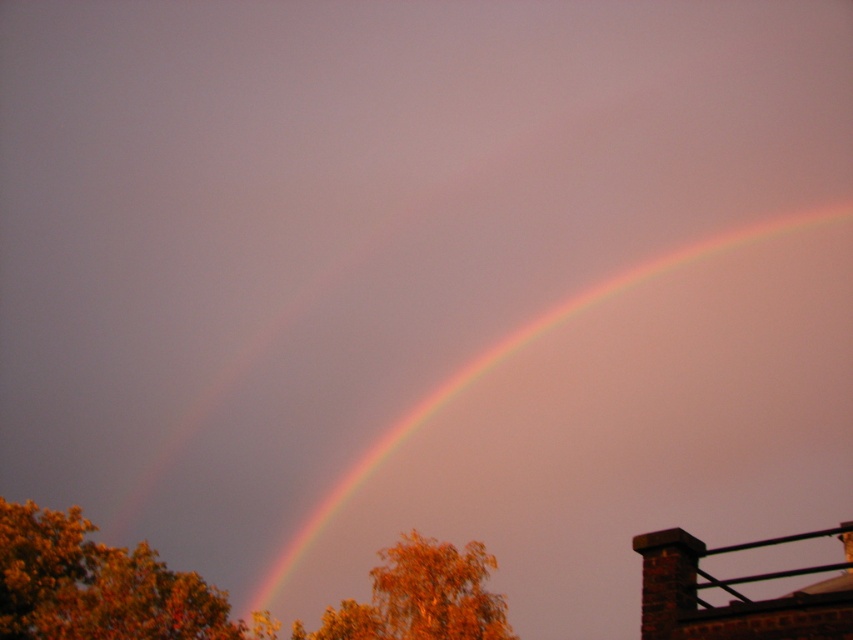
Question: Which object is farther from the camera taking this photo?

Choices:
 (A) rainbow at upper center
 (B) orange leafy tree at center

Answer: (B)

Question: Does autumn leaves at lower left lie behind orange leafy tree at center?

Choices:
 (A) no
 (B) yes

Answer: (A)

Question: Can you confirm if rainbow at upper center is thinner than autumn leaves at lower left?

Choices:
 (A) yes
 (B) no

Answer: (B)

Question: Among these points, which one is farthest from the camera?

Choices:
 (A) (795, 275)
 (B) (426, 560)

Answer: (A)

Question: Which point is closer to the camera taking this photo?

Choices:
 (A) (473, 552)
 (B) (834, 250)

Answer: (A)

Question: Can you confirm if rainbow at upper center is positioned to the right of autumn leaves at lower left?

Choices:
 (A) yes
 (B) no

Answer: (A)